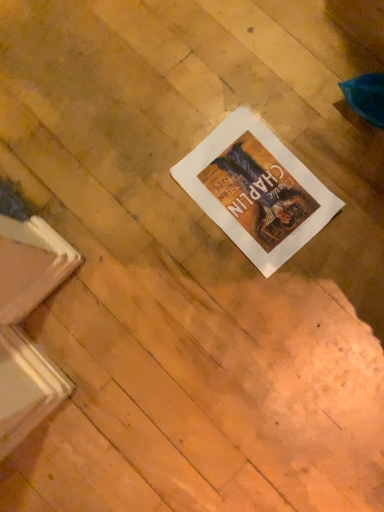
Where is `free space in front of white paper at center`? free space in front of white paper at center is located at coordinates (300, 298).